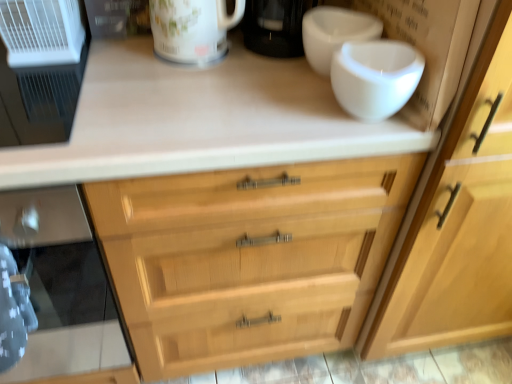
Question: Can you confirm if white glossy bowl at upper right is positioned to the right of black glass oven at left?

Choices:
 (A) no
 (B) yes

Answer: (B)

Question: From a real-world perspective, does white glossy bowl at upper right stand above black glass oven at left?

Choices:
 (A) yes
 (B) no

Answer: (A)

Question: From the image's perspective, is white glossy bowl at upper right on top of black glass oven at left?

Choices:
 (A) yes
 (B) no

Answer: (A)

Question: Is white glossy bowl at upper right facing towards black glass oven at left?

Choices:
 (A) yes
 (B) no

Answer: (B)

Question: Is white glossy bowl at upper right taller than black glass oven at left?

Choices:
 (A) no
 (B) yes

Answer: (A)

Question: Is point (93, 251) positioned closer to the camera than point (80, 77)?

Choices:
 (A) closer
 (B) farther

Answer: (B)

Question: From a real-world perspective, is black glass oven at left physically located above or below white plastic air purifier at left, which is the 1th appliance from bottom to top?

Choices:
 (A) above
 (B) below

Answer: (B)

Question: Is black glass oven at left wider or thinner than white plastic air purifier at left, which is the 1th appliance from bottom to top?

Choices:
 (A) wide
 (B) thin

Answer: (A)

Question: Is black glass oven at left inside the boundaries of white plastic air purifier at left, which is the 1th appliance from bottom to top, or outside?

Choices:
 (A) inside
 (B) outside

Answer: (B)

Question: Choose the correct answer: Is white plastic cage at upper left, which is counted as the second appliance, starting from the bottom, inside black glass oven at left or outside it?

Choices:
 (A) outside
 (B) inside

Answer: (A)

Question: From a real-world perspective, is white plastic cage at upper left, which is counted as the second appliance, starting from the bottom, positioned above or below black glass oven at left?

Choices:
 (A) below
 (B) above

Answer: (B)

Question: Looking at the image, does white plastic cage at upper left, which is counted as the second appliance, starting from the bottom, seem bigger or smaller compared to black glass oven at left?

Choices:
 (A) small
 (B) big

Answer: (A)

Question: Visually, is white plastic cage at upper left, which is counted as the second appliance, starting from the bottom, positioned to the left or to the right of black glass oven at left?

Choices:
 (A) left
 (B) right

Answer: (B)

Question: Does point (50, 283) appear closer or farther from the camera than point (193, 11)?

Choices:
 (A) closer
 (B) farther

Answer: (B)

Question: Would you say black glass oven at left is inside or outside glossy ceramic mug at upper center?

Choices:
 (A) outside
 (B) inside

Answer: (A)